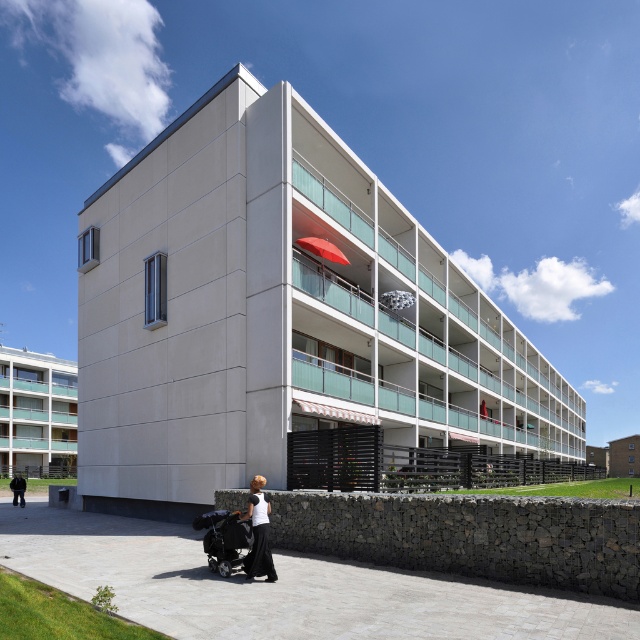
Which is in front, point (195, 528) or point (248, 570)?

Point (248, 570) is in front.

Could you measure the distance between black fabric baby carriage at lower center and black matte dress at lower center?

21.47 inches

The image size is (640, 640). What do you see at coordinates (224, 538) in the screenshot? I see `black fabric baby carriage at lower center` at bounding box center [224, 538].

Identify the location of black fabric baby carriage at lower center. (224, 538).

Who is more forward, [266,572] or [20,480]?

Point [266,572] is in front.

Identify the location of black matte dress at lower center. This screenshot has height=640, width=640. (259, 532).

What do you see at coordinates (224, 538) in the screenshot? I see `black fabric baby carriage at lower center` at bounding box center [224, 538].

Which is in front, point (196, 515) or point (13, 497)?

Positioned in front is point (196, 515).

Measure the distance between black fabric baby carriage at lower center and camera.

black fabric baby carriage at lower center is 11.47 meters from camera.

You are a GUI agent. You are given a task and a screenshot of the screen. Output one action in this format:
    pyautogui.click(x=<x>, y=<y>)
    Task: Click on the black fabric baby carriage at lower center
    The image size is (640, 640).
    Given the screenshot: What is the action you would take?
    pyautogui.click(x=224, y=538)